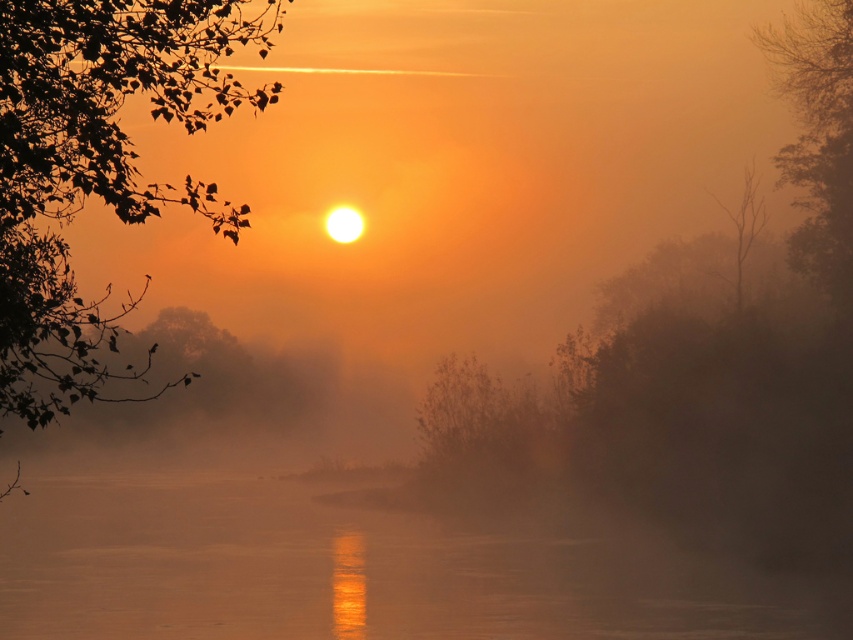
You are standing at the edge of the river and see the point marked at coordinates (352,572). What type of surface is located at that point?

The point at (352,572) corresponds to smooth water at center.

You are an artist trying to sketch the scene. You notice the green matte tree at upper right and the brown fuzzy bush at center. Which object should you draw first if you want to follow the rule of drawing thinner objects before thicker ones?

The green matte tree at upper right should be drawn first because it is thinner than the brown fuzzy bush at center.

You are an artist painting this scene. You want to ensure the green leafy tree at upper left and the green matte tree at upper right are proportionally accurate. Which tree should you paint larger?

The green leafy tree at upper left should be painted larger than the green matte tree at upper right as it is bigger in the scene.